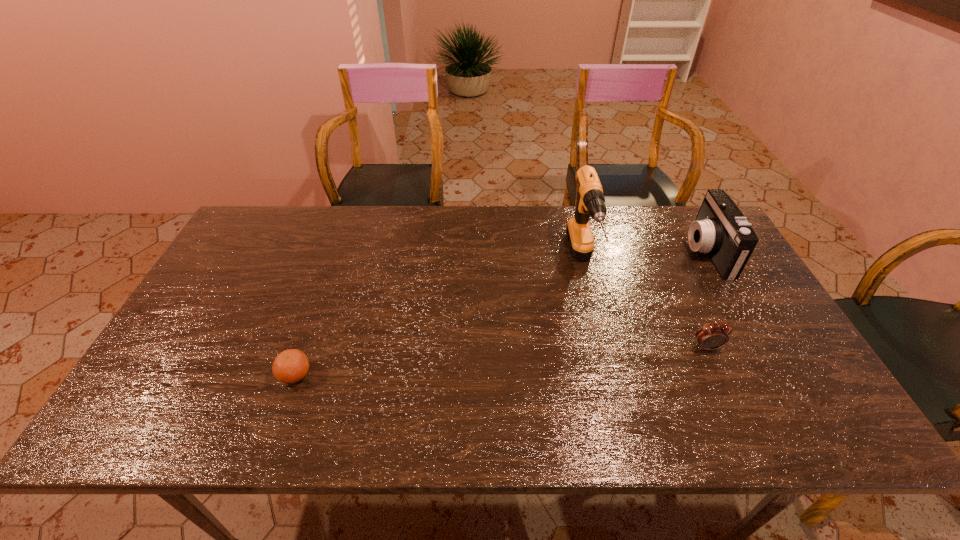
The width and height of the screenshot is (960, 540). In order to click on vacant position at the left edge of the desktop in this screenshot , I will do `click(273, 257)`.

The width and height of the screenshot is (960, 540). Identify the location of free space between the alarm clock and the leftmost object. click(x=501, y=361).

Locate an element on the screen. This screenshot has height=540, width=960. free space between the camcorder and the alarm clock is located at coordinates (707, 300).

Locate an element on the screen. The image size is (960, 540). free space between the rightmost object and the alarm clock is located at coordinates pos(707,300).

Locate an element on the screen. This screenshot has height=540, width=960. vacant space that's between the third object from left to right and the third object from right to left is located at coordinates (644, 305).

The height and width of the screenshot is (540, 960). In order to click on blank region between the drill and the nearest object in this screenshot , I will do `click(439, 319)`.

I want to click on free space between the second nearest object and the drill, so click(644, 305).

Image resolution: width=960 pixels, height=540 pixels. Identify the location of vacant area that lies between the second tallest object and the shortest object. (501, 313).

Locate an element on the screen. This screenshot has width=960, height=540. free space that is in between the camcorder and the second shortest object is located at coordinates (707, 300).

At what (x,y) coordinates should I click in order to perform the action: click on free space between the third shortest object and the leftmost object. Please return your answer as a coordinate pair (x, y). Looking at the image, I should click on 501,313.